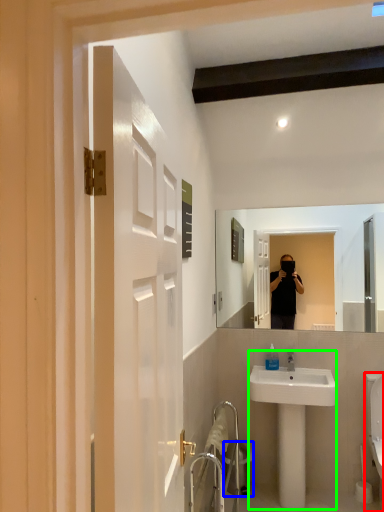
Question: Which is farther away from toilet (highlighted by a red box)? trash bin/can (highlighted by a blue box) or sink (highlighted by a green box)?

Choices:
 (A) trash bin/can
 (B) sink

Answer: (A)